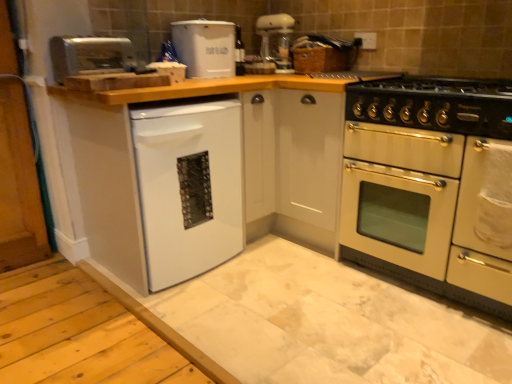
In order to click on free point in front of white glossy dishwasher at lower left in this screenshot , I will do `click(155, 326)`.